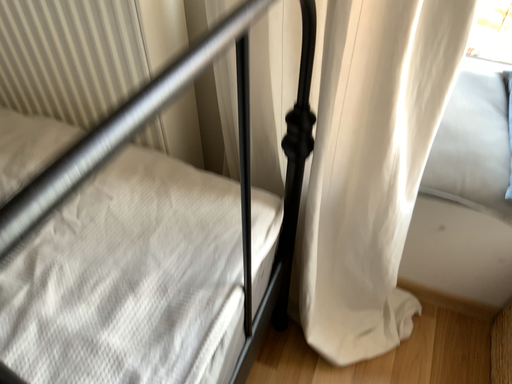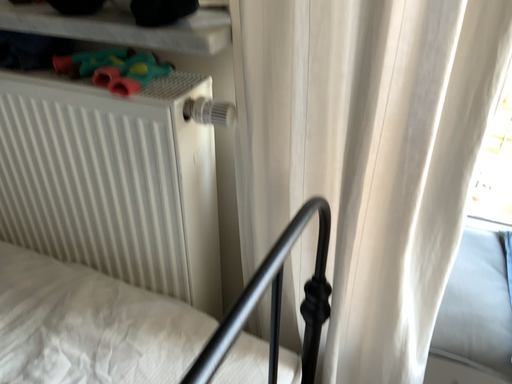
Question: How did the camera likely rotate when shooting the video?

Choices:
 (A) rotated downward
 (B) rotated upward

Answer: (B)